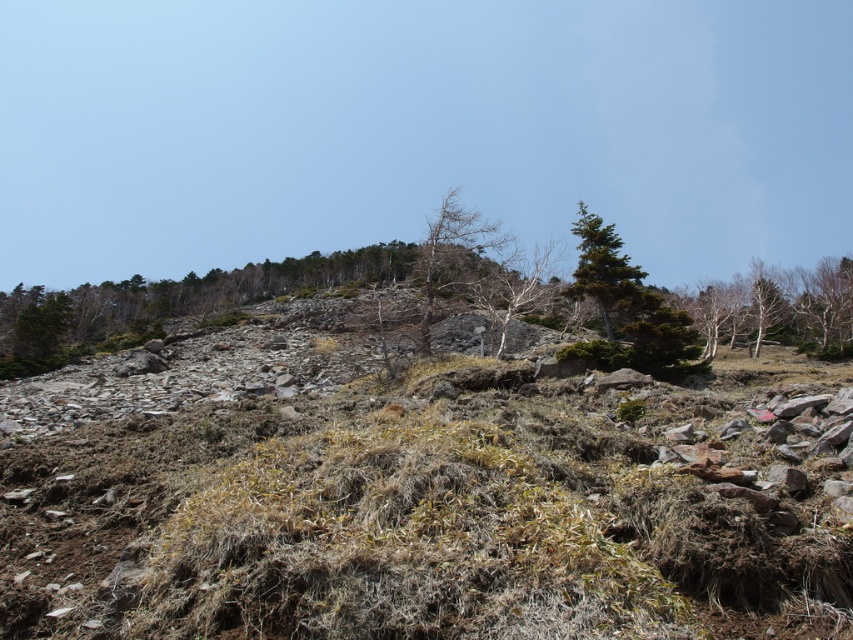
Question: Which object is positioned farthest from the bare wood tree at center?

Choices:
 (A) bare bark trees at upper right
 (B) green textured tree at upper center

Answer: (A)

Question: Can you confirm if bare bark trees at upper right is smaller than green textured tree at upper center?

Choices:
 (A) no
 (B) yes

Answer: (A)

Question: Does bare wood tree at center appear over green textured tree at upper center?

Choices:
 (A) no
 (B) yes

Answer: (B)

Question: In this image, where is bare bark trees at upper right located relative to green textured tree at upper center?

Choices:
 (A) left
 (B) right

Answer: (B)

Question: Based on their relative distances, which object is nearer to the bare wood tree at center?

Choices:
 (A) green textured tree at upper center
 (B) bare bark trees at upper right

Answer: (A)

Question: Which point appears farthest from the camera in this image?

Choices:
 (A) (824, 294)
 (B) (450, 188)
 (C) (624, 292)

Answer: (B)